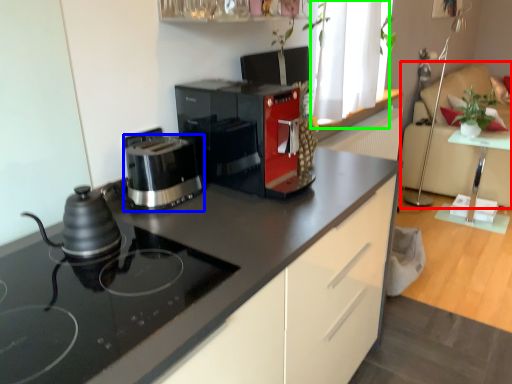
Question: Which object is positioned closest to chair (highlighted by a red box)? Select from kitchen appliance (highlighted by a blue box) and window (highlighted by a green box).

Choices:
 (A) kitchen appliance
 (B) window

Answer: (B)